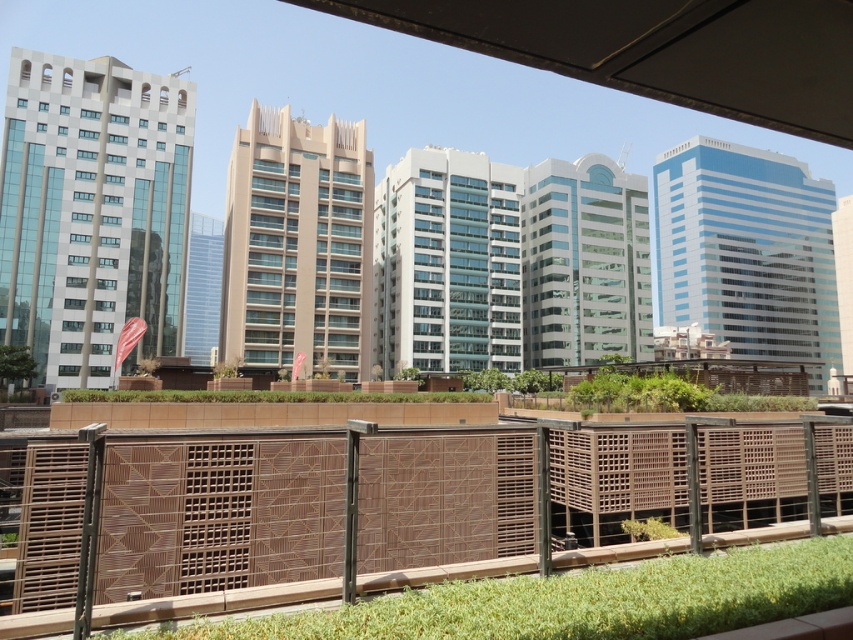
Question: Is brown textured fence at lower center smaller than green grass at lower center?

Choices:
 (A) yes
 (B) no

Answer: (B)

Question: Can you confirm if brown textured fence at lower center is smaller than green grass at lower center?

Choices:
 (A) no
 (B) yes

Answer: (A)

Question: Does brown textured fence at lower center have a greater width compared to green grass at lower center?

Choices:
 (A) yes
 (B) no

Answer: (A)

Question: Which point is farther to the camera?

Choices:
 (A) (674, 557)
 (B) (357, 548)

Answer: (A)